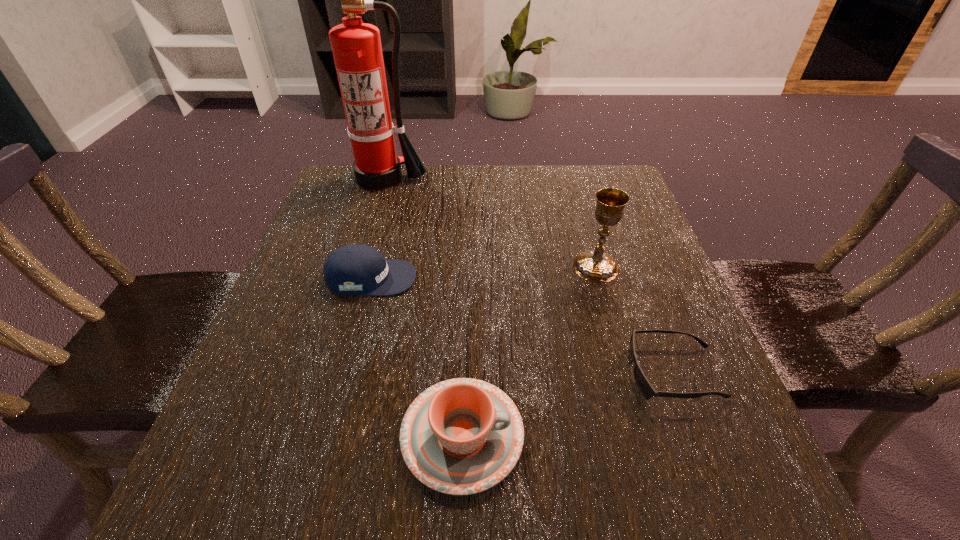
This screenshot has width=960, height=540. Find the location of `the tallest object`. the tallest object is located at coordinates (356, 46).

Find the location of a particular element. The width and height of the screenshot is (960, 540). the farthest object is located at coordinates (356, 46).

Identify the location of chalice. This screenshot has height=540, width=960. (594, 265).

Locate an element on the screen. This screenshot has width=960, height=540. baseball cap is located at coordinates (353, 269).

Identify the location of the third object from right to left. (462, 436).

Where is `the shortest object`? the shortest object is located at coordinates (646, 389).

At what (x,y) coordinates should I click in order to perform the action: click on free spot located at the nozzle of the farthest object. Please return your answer as a coordinate pair (x, y). Image resolution: width=960 pixels, height=540 pixels. Looking at the image, I should click on (354, 269).

Where is `blank space located 0.240m on the front of the chalice`? Image resolution: width=960 pixels, height=540 pixels. blank space located 0.240m on the front of the chalice is located at coordinates (630, 384).

Identify the location of free point located on the front-facing side of the baseball cap. (582, 278).

You are a GUI agent. You are given a task and a screenshot of the screen. Output one action in this format:
    pyautogui.click(x=<x>, y=<y>)
    Task: Click on the vacant area situated on the handle side of the third object from right to left
    This screenshot has height=540, width=960.
    Given the screenshot: What is the action you would take?
    pyautogui.click(x=624, y=436)